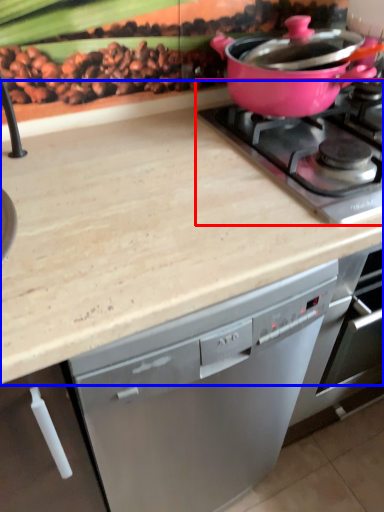
Question: Which object appears closest to the camera in this image, gas stove (highlighted by a red box) or countertop (highlighted by a blue box)?

Choices:
 (A) gas stove
 (B) countertop

Answer: (B)